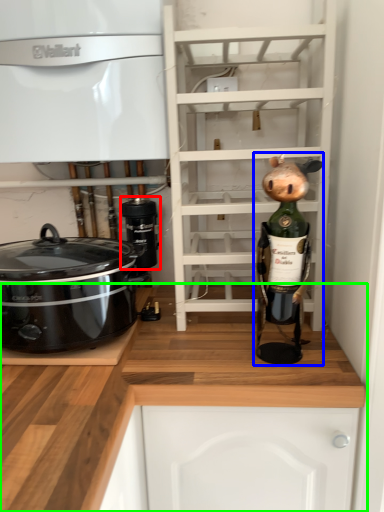
Question: Which object is the farthest from appliance (highlighted by a red box)? Choose among these: toy (highlighted by a blue box) or cabinetry (highlighted by a green box).

Choices:
 (A) toy
 (B) cabinetry

Answer: (A)